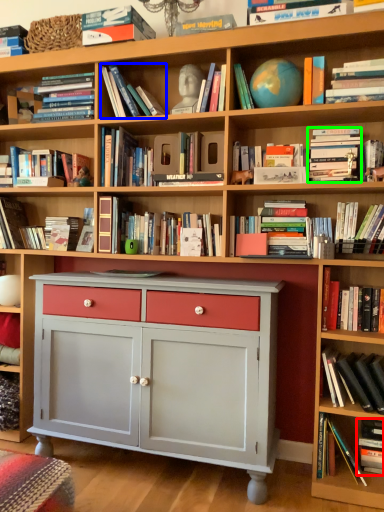
Question: Estimate the real-world distances between objects in this image. Which object is closer to book (highlighted by a red box), book (highlighted by a blue box) or book (highlighted by a green box)?

Choices:
 (A) book
 (B) book

Answer: (B)